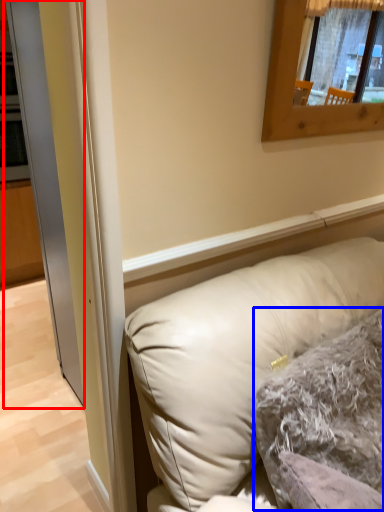
Question: Which of the following is the farthest to the observer, glass door (highlighted by a red box) or pillow (highlighted by a blue box)?

Choices:
 (A) glass door
 (B) pillow

Answer: (B)